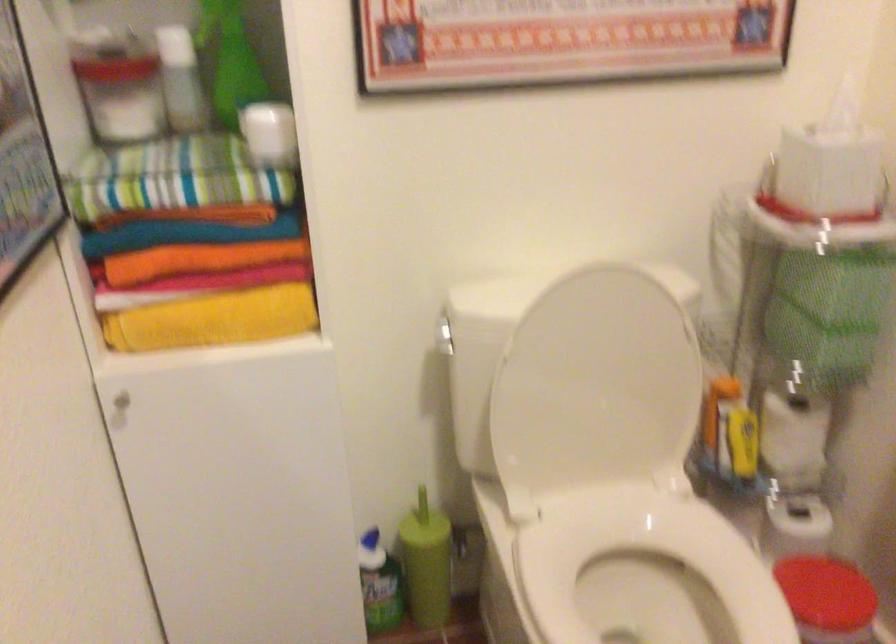
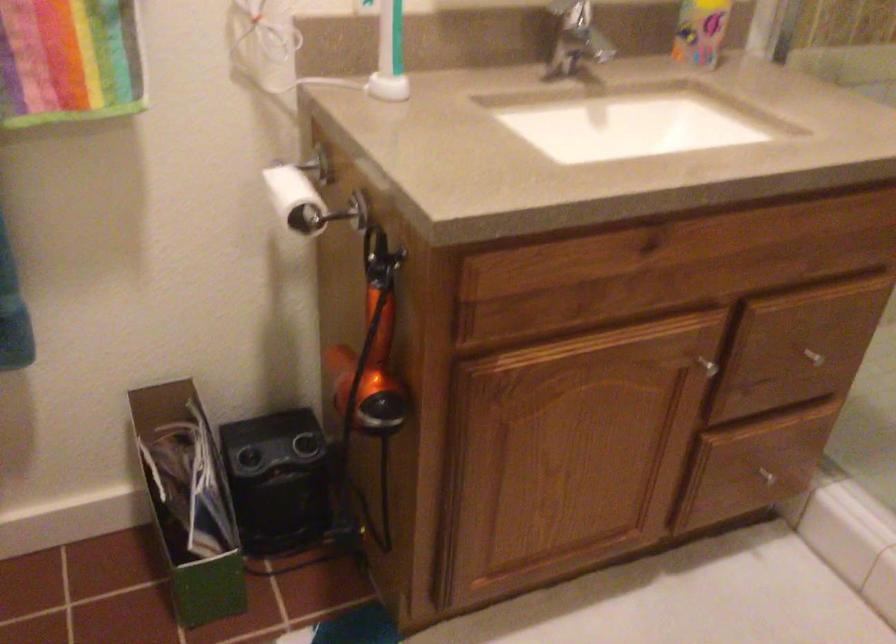
How did the camera likely rotate?

The camera rotated toward right-down.